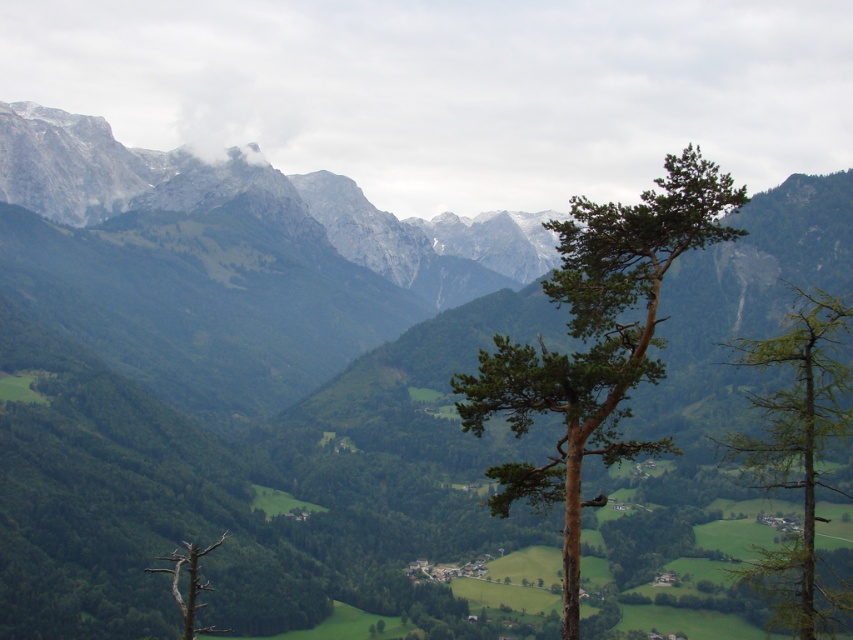
You are an environmental researcher analyzing the image. You see the green rough bark tree at center and the brown deadwood at lower left. Which of these two objects is located higher up in the image?

The green rough bark tree at center is positioned over the brown deadwood at lower left, so it is higher up in the image.

You are an environmental scientist assessing the health of the trees in the mountainous landscape. You observe the green rough bark tree at center and the green lacy tree at right. Which tree is situated higher in elevation?

The green rough bark tree at center is positioned over the green lacy tree at right, meaning it is higher in elevation.